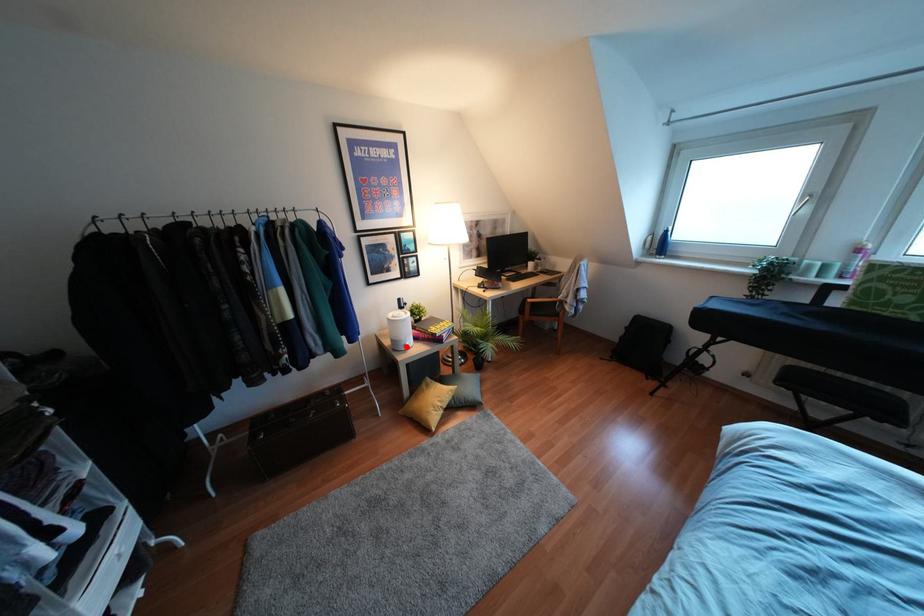
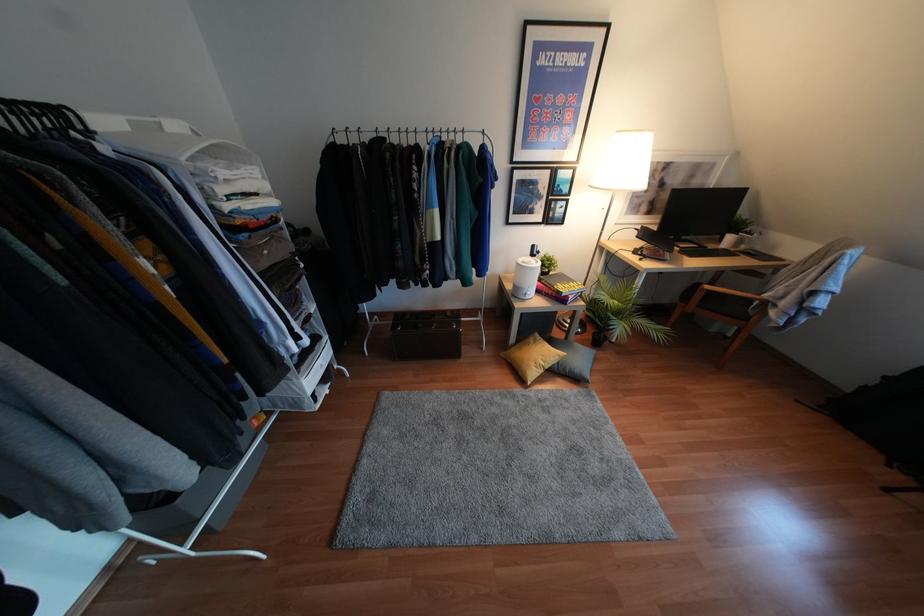
Question: I am providing you with two images of the same scene from different viewpoints. A red point is shown in image1. For the corresponding object point in image2, is it positioned nearer or farther from the camera?

Choices:
 (A) Nearer
 (B) Farther

Answer: (A)